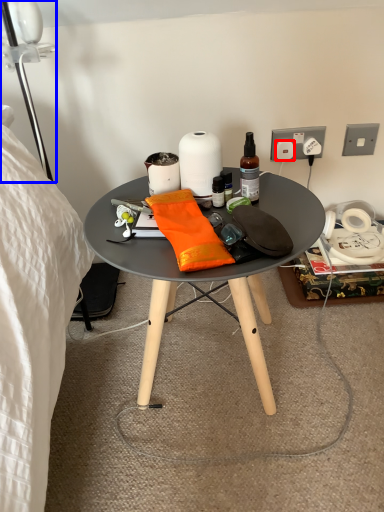
Question: Which of the following is the farthest to the observer, power outlet (highlighted by a red box) or lamp (highlighted by a blue box)?

Choices:
 (A) power outlet
 (B) lamp

Answer: (A)